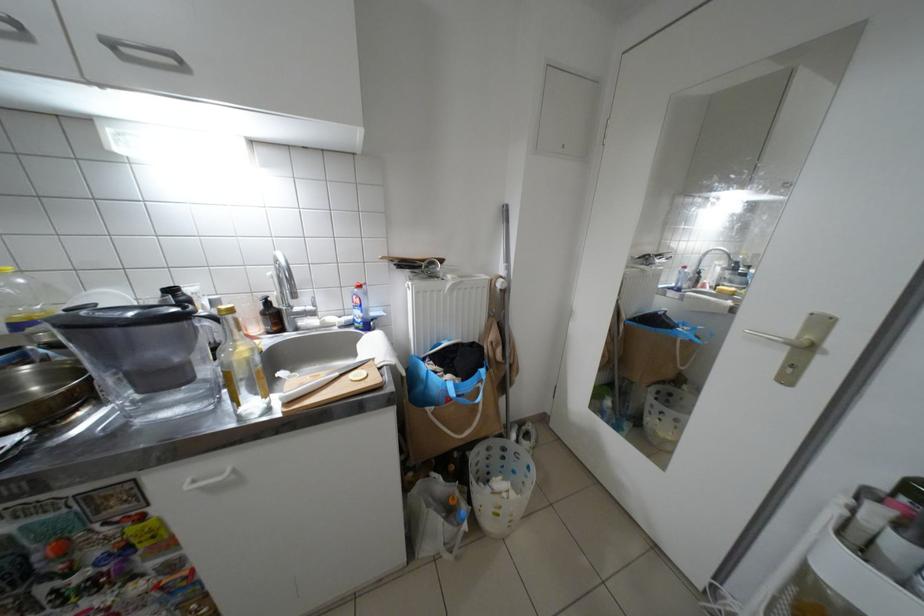
Image resolution: width=924 pixels, height=616 pixels. What do you see at coordinates (506, 315) in the screenshot?
I see `the gray mop handle` at bounding box center [506, 315].